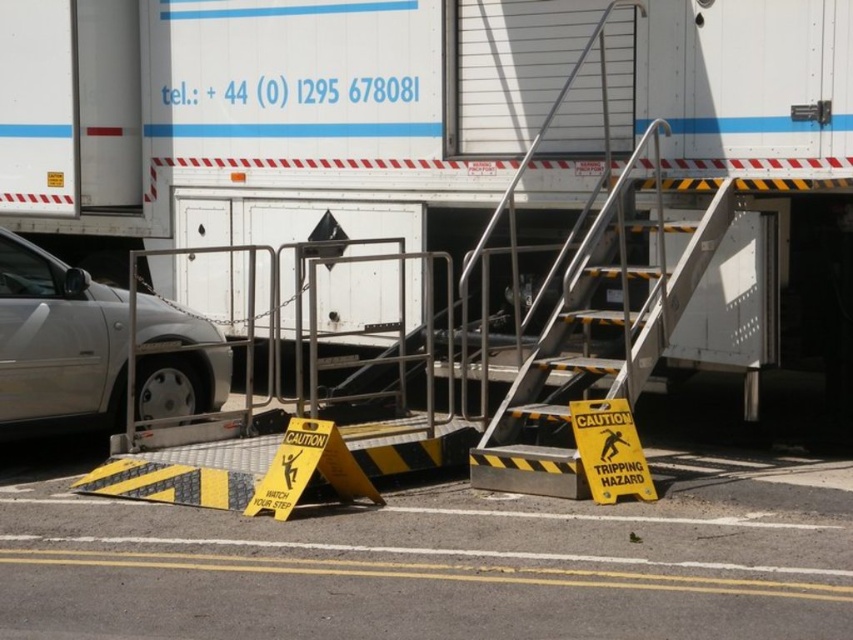
Question: Does silver metallic car at left have a smaller size compared to yellow plastic caution sign at lower center?

Choices:
 (A) yes
 (B) no

Answer: (B)

Question: Can you confirm if silver metallic car at left is positioned below yellow plastic caution sign at lower center?

Choices:
 (A) no
 (B) yes

Answer: (A)

Question: Which point appears closest to the camera in this image?

Choices:
 (A) (608, 481)
 (B) (259, 499)
 (C) (189, 289)

Answer: (B)

Question: Is white matte truck at center wider than yellow plastic caution sign at lower center?

Choices:
 (A) yes
 (B) no

Answer: (B)

Question: Which of the following is the farthest from the observer?

Choices:
 (A) (635, 445)
 (B) (6, 280)
 (C) (338, 160)
 (D) (299, 454)

Answer: (C)

Question: Which point is closer to the camera?

Choices:
 (A) white matte truck at center
 (B) silver metallic car at left
 (C) yellow plastic caution sign at lower center
 (D) yellow plastic caution sign at center

Answer: (D)